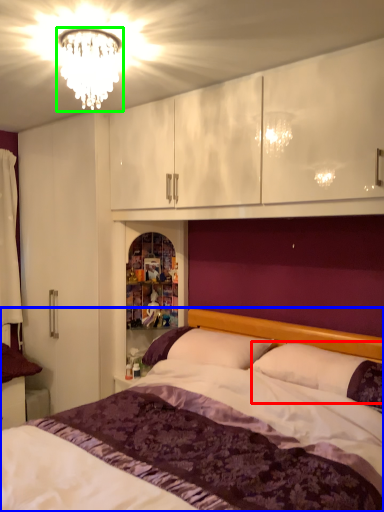
Question: Which object is the farthest from pillow (highlighted by a red box)? Choose among these: bed (highlighted by a blue box) or fixture (highlighted by a green box).

Choices:
 (A) bed
 (B) fixture

Answer: (B)